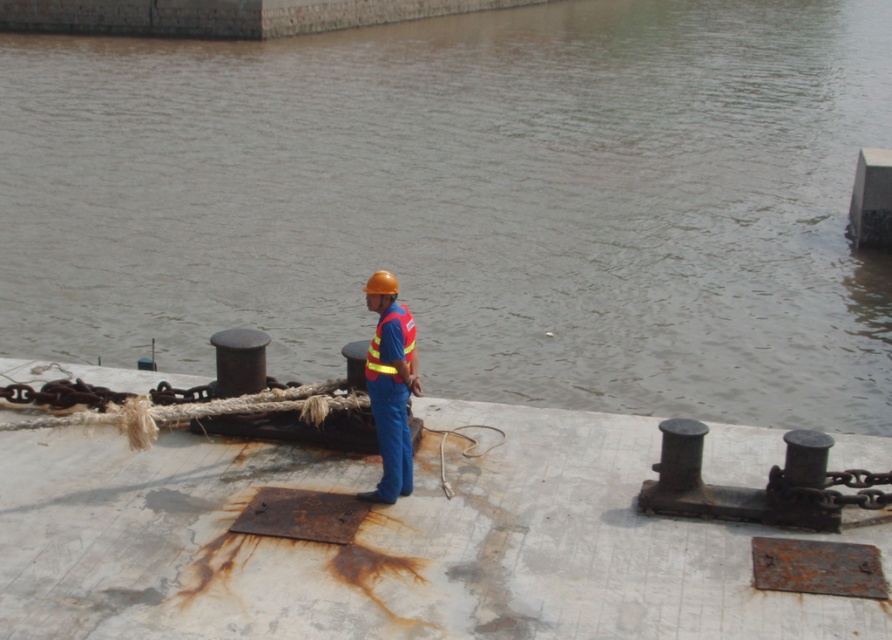
You are a safety inspector on the dock. You notice the brown murky water at center and the reflective fabric safety vest at center. According to the scene, which object is positioned to the right side of the other?

The reflective fabric safety vest at center is positioned to the right of the brown murky water at center because the brown murky water at center is to the left of reflective fabric safety vest at center.

You are a safety inspector checking the visibility of workers on the dock. The blue fabric worker at center is wearing the reflective fabric safety vest at center. Since the vest is part of the worker, does the vest need to be wider than the worker to be visible?

The blue fabric worker at center is larger in width than the reflective fabric safety vest at center, so the vest does not need to be wider than the worker to be visible.